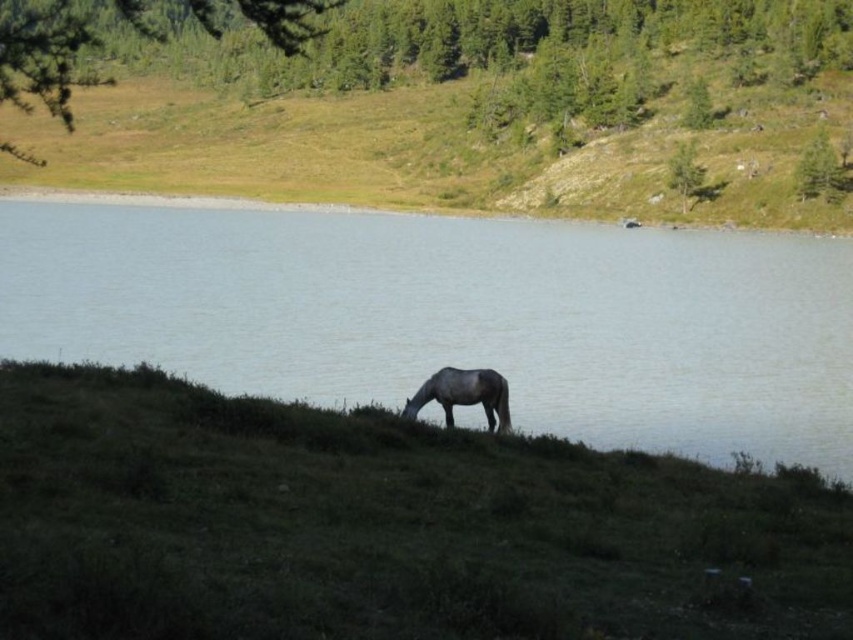
Does green grassy at lower center have a larger size compared to clear water at center?

No, green grassy at lower center is not bigger than clear water at center.

Where is `green grassy at lower center`? green grassy at lower center is located at coordinates (381, 525).

Does green grassy at lower center have a smaller size compared to green grassy hillside at center?

Yes.

Which of these two, green grassy at lower center or green grassy hillside at center, stands taller?

green grassy hillside at center is taller.

Is point (592, 467) in front of point (218, 170)?

That is True.

Find the location of `green grassy at lower center`. green grassy at lower center is located at coordinates (381, 525).

Can you confirm if clear water at center is wider than gray matte horse at lower center?

Correct, the width of clear water at center exceeds that of gray matte horse at lower center.

Does clear water at center appear on the right side of gray matte horse at lower center?

In fact, clear water at center is to the left of gray matte horse at lower center.

Does point (56, 218) come closer to viewer compared to point (492, 401)?

No, it is not.

The height and width of the screenshot is (640, 853). Find the location of `clear water at center`. clear water at center is located at coordinates (456, 316).